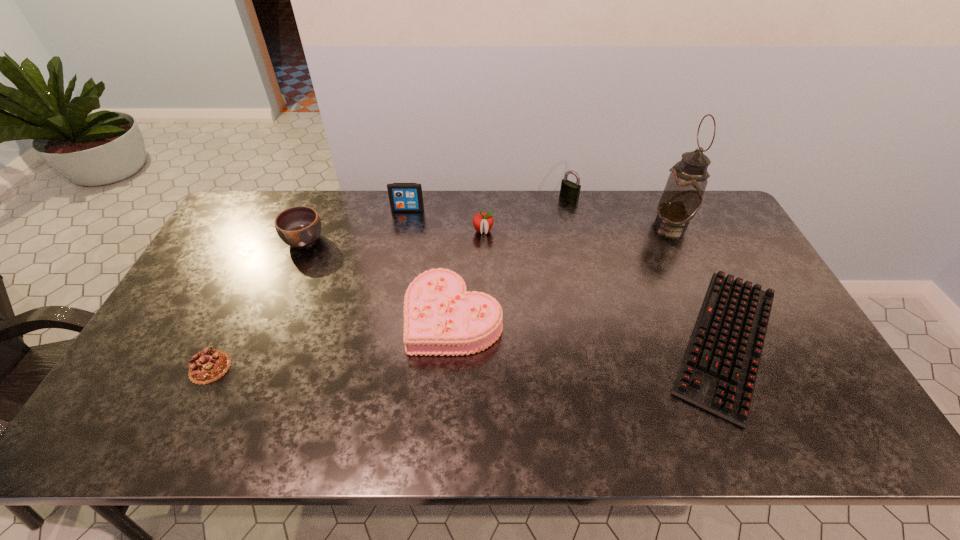
In order to click on bowl that is at the far edge in this screenshot , I will do `click(300, 226)`.

Where is `apple at the far edge`? Image resolution: width=960 pixels, height=540 pixels. apple at the far edge is located at coordinates (483, 222).

The height and width of the screenshot is (540, 960). What are the coordinates of `object at the near edge` in the screenshot? It's located at (718, 373).

Where is `object at the left edge`? object at the left edge is located at coordinates (207, 366).

The width and height of the screenshot is (960, 540). Identify the location of oil lamp that is positioned at the right edge. (683, 194).

Locate an element on the screen. computer keyboard that is at the right edge is located at coordinates (718, 373).

This screenshot has height=540, width=960. In order to click on object present at the far right corner in this screenshot , I will do `click(683, 194)`.

Identify the location of object located at the near right corner. (718, 373).

Where is `free space at the far edge of the desktop`? The height and width of the screenshot is (540, 960). free space at the far edge of the desktop is located at coordinates (502, 220).

I want to click on vacant area at the near edge of the desktop, so click(629, 418).